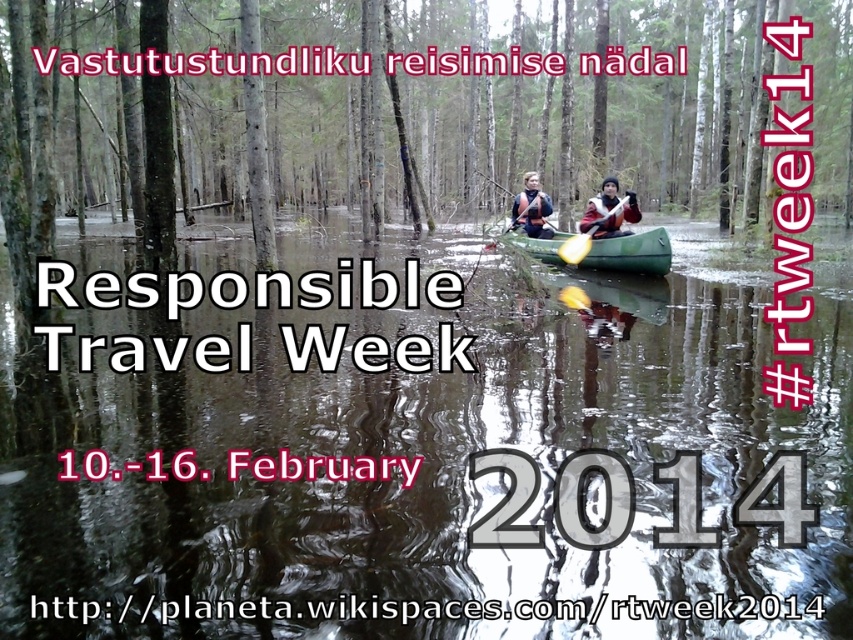
Between green rubber canoe at center and brown fur coat at center, which one is positioned higher?

Positioned higher is brown fur coat at center.

Locate an element on the screen. green rubber canoe at center is located at coordinates (631, 252).

Does point (596, 221) come behind point (601, 221)?

Yes, it is.

Can you confirm if brown fur coat at center is positioned above yellow foam paddle at center?

Yes.

Image resolution: width=853 pixels, height=640 pixels. I want to click on brown fur coat at center, so click(x=608, y=209).

Image resolution: width=853 pixels, height=640 pixels. What are the coordinates of `brown fur coat at center` in the screenshot? It's located at (608, 209).

Does point (538, 209) lie in front of point (573, 237)?

No, (538, 209) is behind (573, 237).

Describe the element at coordinates (532, 209) in the screenshot. I see `matte black kayak at center` at that location.

Measure the distance between matte black kayak at center and camera.

matte black kayak at center is 51.87 feet from camera.

Where is `matte black kayak at center`? matte black kayak at center is located at coordinates pyautogui.click(x=532, y=209).